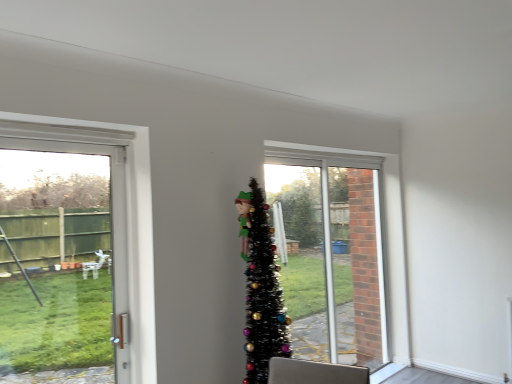
Question: Is there a large distance between black tinsel christmas tree at center and clear glass window at center?

Choices:
 (A) no
 (B) yes

Answer: (B)

Question: Does black tinsel christmas tree at center appear on the right side of clear glass window at center?

Choices:
 (A) yes
 (B) no

Answer: (B)

Question: Considering the relative sizes of black tinsel christmas tree at center and clear glass window at center in the image provided, is black tinsel christmas tree at center thinner than clear glass window at center?

Choices:
 (A) no
 (B) yes

Answer: (A)

Question: Would you say clear glass window at center is part of black tinsel christmas tree at center's contents?

Choices:
 (A) no
 (B) yes

Answer: (A)

Question: From a real-world perspective, is black tinsel christmas tree at center beneath clear glass window at center?

Choices:
 (A) no
 (B) yes

Answer: (A)

Question: Does black tinsel christmas tree at center appear on the left side of clear glass window at center?

Choices:
 (A) no
 (B) yes

Answer: (B)

Question: Is there a large distance between black tinsel christmas tree at center and white plastic door at left?

Choices:
 (A) no
 (B) yes

Answer: (B)

Question: Is white plastic door at left inside black tinsel christmas tree at center?

Choices:
 (A) yes
 (B) no

Answer: (B)

Question: Is black tinsel christmas tree at center facing away from white plastic door at left?

Choices:
 (A) yes
 (B) no

Answer: (B)

Question: Considering the relative sizes of black tinsel christmas tree at center and white plastic door at left in the image provided, is black tinsel christmas tree at center wider than white plastic door at left?

Choices:
 (A) yes
 (B) no

Answer: (A)

Question: Is black tinsel christmas tree at center closer to camera compared to white plastic door at left?

Choices:
 (A) yes
 (B) no

Answer: (B)

Question: Is black tinsel christmas tree at center oriented towards white plastic door at left?

Choices:
 (A) no
 (B) yes

Answer: (A)

Question: Could black tinsel christmas tree at center be considered to be inside white plastic door at left?

Choices:
 (A) no
 (B) yes

Answer: (A)